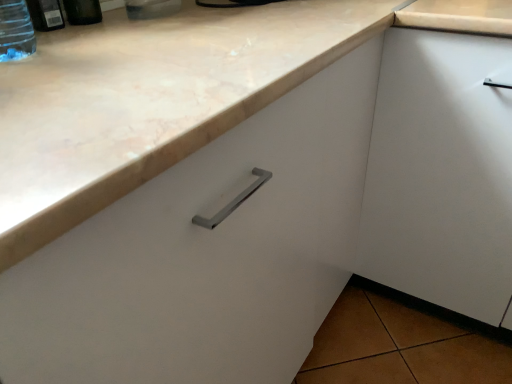
Measure the distance between transparent plastic bottle at upper left, placed as the second bottle when sorted from right to left, and camera.

A distance of 30.79 inches exists between transparent plastic bottle at upper left, placed as the second bottle when sorted from right to left, and camera.

At what (x,y) coordinates should I click in order to perform the action: click on matte plastic bottle at upper left, the first bottle in the right-to-left sequence. Please return your answer as a coordinate pair (x, y). Looking at the image, I should click on (83, 11).

From the picture: Between transparent plastic bottle at upper left, the first bottle in the left-to-right sequence, and matte plastic bottle at upper left, the first bottle in the right-to-left sequence, which one appears on the left side from the viewer's perspective?

transparent plastic bottle at upper left, the first bottle in the left-to-right sequence, is more to the left.

I want to click on bottle that is the 2nd object located below the matte plastic bottle at upper left, the first bottle in the right-to-left sequence (from the image's perspective), so [15, 31].

In the scene shown: Does transparent plastic bottle at upper left, the first bottle in the left-to-right sequence, have a lesser width compared to matte plastic bottle at upper left, the 3th bottle positioned from the left?

Yes.

Is matte plastic bottle at upper left, the 3th bottle positioned from the left, at the back of transparent plastic bottle at upper left, which ranks as the third bottle in right-to-left order?

No, transparent plastic bottle at upper left, which ranks as the third bottle in right-to-left order, is not facing the opposite direction of matte plastic bottle at upper left, the 3th bottle positioned from the left.

Considering the sizes of objects transparent plastic bottle at upper left, placed as the second bottle when sorted from right to left, and matte plastic bottle at upper left, the 3th bottle positioned from the left, in the image provided, who is shorter, transparent plastic bottle at upper left, placed as the second bottle when sorted from right to left, or matte plastic bottle at upper left, the 3th bottle positioned from the left,?

transparent plastic bottle at upper left, placed as the second bottle when sorted from right to left, is shorter.

Could you tell me if transparent plastic bottle at upper left, marked as the 2th bottle in a left-to-right arrangement, is facing matte plastic bottle at upper left, the first bottle in the right-to-left sequence?

No, transparent plastic bottle at upper left, marked as the 2th bottle in a left-to-right arrangement, is not oriented towards matte plastic bottle at upper left, the first bottle in the right-to-left sequence.

Is transparent plastic bottle at upper left, marked as the 2th bottle in a left-to-right arrangement, not near matte plastic bottle at upper left, the 3th bottle positioned from the left?

That's not correct — transparent plastic bottle at upper left, marked as the 2th bottle in a left-to-right arrangement, is a little close to matte plastic bottle at upper left, the 3th bottle positioned from the left.

Identify the location of the 2nd bottle above the transparent plastic bottle at upper left, marked as the 2th bottle in a left-to-right arrangement (from a real-world perspective). (83, 11).

Which is farther, (58, 20) or (16, 37)?

The point (58, 20) is behind.

Measure the distance between transparent plastic bottle at upper left, marked as the 2th bottle in a left-to-right arrangement, and transparent plastic bottle at upper left, which ranks as the third bottle in right-to-left order.

6.53 inches.

Considering the sizes of transparent plastic bottle at upper left, placed as the second bottle when sorted from right to left, and transparent plastic bottle at upper left, which ranks as the third bottle in right-to-left order, in the image, is transparent plastic bottle at upper left, placed as the second bottle when sorted from right to left, taller or shorter than transparent plastic bottle at upper left, which ranks as the third bottle in right-to-left order,?

Considering their sizes, transparent plastic bottle at upper left, placed as the second bottle when sorted from right to left, has less height than transparent plastic bottle at upper left, which ranks as the third bottle in right-to-left order.

Is transparent plastic bottle at upper left, placed as the second bottle when sorted from right to left, not near transparent plastic bottle at upper left, which ranks as the third bottle in right-to-left order?

transparent plastic bottle at upper left, placed as the second bottle when sorted from right to left, is near transparent plastic bottle at upper left, which ranks as the third bottle in right-to-left order, not far away.

Does transparent plastic bottle at upper left, marked as the 2th bottle in a left-to-right arrangement, have a lesser height compared to marble countertop at upper left?

Correct, transparent plastic bottle at upper left, marked as the 2th bottle in a left-to-right arrangement, is not as tall as marble countertop at upper left.

From the image's perspective, which one is positioned lower, transparent plastic bottle at upper left, marked as the 2th bottle in a left-to-right arrangement, or marble countertop at upper left?

From the image's view, marble countertop at upper left is below.

Between transparent plastic bottle at upper left, placed as the second bottle when sorted from right to left, and marble countertop at upper left, which one appears on the right side from the viewer's perspective?

From the viewer's perspective, marble countertop at upper left appears more on the right side.

From a real-world perspective, which is physically above, transparent plastic bottle at upper left, which ranks as the third bottle in right-to-left order, or marble countertop at upper left?

transparent plastic bottle at upper left, which ranks as the third bottle in right-to-left order, is physically above.

Can you confirm if transparent plastic bottle at upper left, which ranks as the third bottle in right-to-left order, is positioned to the right of marble countertop at upper left?

No.

Considering the relative sizes of transparent plastic bottle at upper left, which ranks as the third bottle in right-to-left order, and marble countertop at upper left in the image provided, is transparent plastic bottle at upper left, which ranks as the third bottle in right-to-left order, smaller than marble countertop at upper left?

Yes, transparent plastic bottle at upper left, which ranks as the third bottle in right-to-left order, is smaller than marble countertop at upper left.

Is transparent plastic bottle at upper left, the first bottle in the left-to-right sequence, next to marble countertop at upper left and touching it?

transparent plastic bottle at upper left, the first bottle in the left-to-right sequence, is not next to marble countertop at upper left, and they're not touching.

Based on the photo, what's the angular difference between matte plastic bottle at upper left, the 3th bottle positioned from the left, and transparent plastic bottle at upper left, placed as the second bottle when sorted from right to left,'s facing directions?

They differ by 0.000804 degrees in their facing directions.

From a real-world perspective, starting from the matte plastic bottle at upper left, the first bottle in the right-to-left sequence, which bottle is the 2nd one below it? Please provide its 2D coordinates.

[(45, 14)]

Considering the positions of point (71, 18) and point (51, 13), is point (71, 18) closer or farther from the camera than point (51, 13)?

Point (71, 18).

Based on the photo, are transparent plastic bottle at upper left, which ranks as the third bottle in right-to-left order, and transparent plastic bottle at upper left, marked as the 2th bottle in a left-to-right arrangement, beside each other?

No, transparent plastic bottle at upper left, which ranks as the third bottle in right-to-left order, is not with transparent plastic bottle at upper left, marked as the 2th bottle in a left-to-right arrangement.

From the image's perspective, count 1st bottles upward from the transparent plastic bottle at upper left, the first bottle in the left-to-right sequence, and point to it. Please provide its 2D coordinates.

[(45, 14)]

Between transparent plastic bottle at upper left, which ranks as the third bottle in right-to-left order, and transparent plastic bottle at upper left, placed as the second bottle when sorted from right to left, which one appears on the right side from the viewer's perspective?

From the viewer's perspective, transparent plastic bottle at upper left, placed as the second bottle when sorted from right to left, appears more on the right side.

Consider the image. Is transparent plastic bottle at upper left, the first bottle in the left-to-right sequence, looking in the opposite direction of transparent plastic bottle at upper left, marked as the 2th bottle in a left-to-right arrangement?

transparent plastic bottle at upper left, the first bottle in the left-to-right sequence, does not have its back to transparent plastic bottle at upper left, marked as the 2th bottle in a left-to-right arrangement.

Where is `the 1st bottle positioned below the matte plastic bottle at upper left, the 3th bottle positioned from the left (from a real-world perspective)`? the 1st bottle positioned below the matte plastic bottle at upper left, the 3th bottle positioned from the left (from a real-world perspective) is located at coordinates (15, 31).

I want to click on the 1st bottle counting from the left of the matte plastic bottle at upper left, the 3th bottle positioned from the left, so click(x=45, y=14).

Which object lies further to the anchor point transparent plastic bottle at upper left, the first bottle in the left-to-right sequence, matte plastic bottle at upper left, the first bottle in the right-to-left sequence, or transparent plastic bottle at upper left, placed as the second bottle when sorted from right to left?

Based on the image, matte plastic bottle at upper left, the first bottle in the right-to-left sequence, appears to be further to transparent plastic bottle at upper left, the first bottle in the left-to-right sequence.

Estimate the real-world distances between objects in this image. Which object is further from transparent plastic bottle at upper left, the first bottle in the left-to-right sequence, marble countertop at upper left or matte plastic bottle at upper left, the 3th bottle positioned from the left?

marble countertop at upper left is positioned further to the anchor transparent plastic bottle at upper left, the first bottle in the left-to-right sequence.

Looking at the image, which one is located further to marble countertop at upper left, matte plastic bottle at upper left, the 3th bottle positioned from the left, or transparent plastic bottle at upper left, the first bottle in the left-to-right sequence?

matte plastic bottle at upper left, the 3th bottle positioned from the left, is further to marble countertop at upper left.

Based on their spatial positions, is matte plastic bottle at upper left, the first bottle in the right-to-left sequence, or transparent plastic bottle at upper left, marked as the 2th bottle in a left-to-right arrangement, closer to marble countertop at upper left?

transparent plastic bottle at upper left, marked as the 2th bottle in a left-to-right arrangement.

Which object lies further to the anchor point transparent plastic bottle at upper left, which ranks as the third bottle in right-to-left order, transparent plastic bottle at upper left, placed as the second bottle when sorted from right to left, or matte plastic bottle at upper left, the first bottle in the right-to-left sequence?

matte plastic bottle at upper left, the first bottle in the right-to-left sequence, is positioned further to the anchor transparent plastic bottle at upper left, which ranks as the third bottle in right-to-left order.

When comparing their distances from marble countertop at upper left, does transparent plastic bottle at upper left, marked as the 2th bottle in a left-to-right arrangement, or matte plastic bottle at upper left, the first bottle in the right-to-left sequence, seem closer?

transparent plastic bottle at upper left, marked as the 2th bottle in a left-to-right arrangement.

Looking at the image, which one is located closer to matte plastic bottle at upper left, the 3th bottle positioned from the left, marble countertop at upper left or transparent plastic bottle at upper left, placed as the second bottle when sorted from right to left?

transparent plastic bottle at upper left, placed as the second bottle when sorted from right to left.

Which object lies nearer to the anchor point marble countertop at upper left, transparent plastic bottle at upper left, which ranks as the third bottle in right-to-left order, or matte plastic bottle at upper left, the first bottle in the right-to-left sequence?

transparent plastic bottle at upper left, which ranks as the third bottle in right-to-left order.

Identify the location of bottle between marble countertop at upper left and transparent plastic bottle at upper left, placed as the second bottle when sorted from right to left, in the front-back direction. The image size is (512, 384). (15, 31).

I want to click on bottle between matte plastic bottle at upper left, the 3th bottle positioned from the left, and transparent plastic bottle at upper left, the first bottle in the left-to-right sequence, from top to bottom, so click(x=45, y=14).